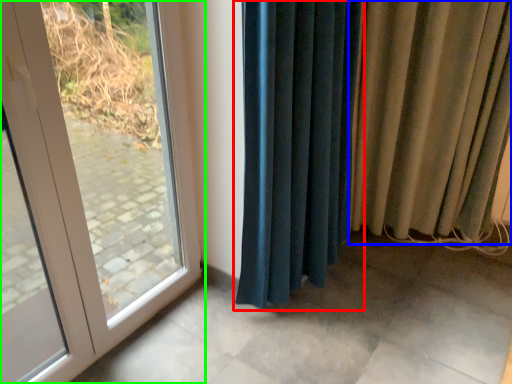
Question: Which object is the farthest from curtain (highlighted by a red box)? Choose among these: curtain (highlighted by a blue box) or door (highlighted by a green box).

Choices:
 (A) curtain
 (B) door

Answer: (B)